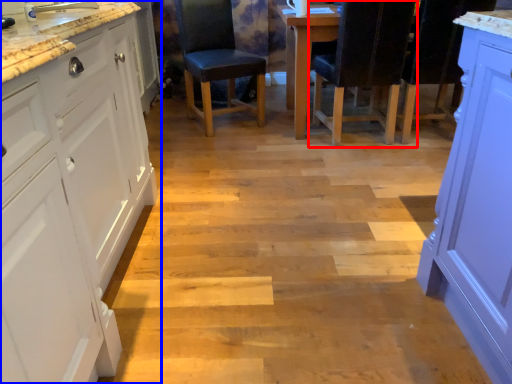
Question: Among these objects, which one is farthest to the camera, chair (highlighted by a red box) or cabinetry (highlighted by a blue box)?

Choices:
 (A) chair
 (B) cabinetry

Answer: (A)